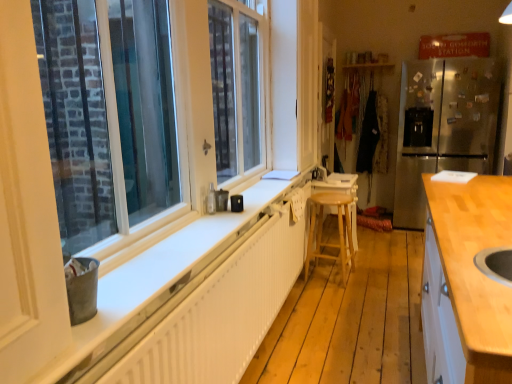
Locate an element on the screen. vacant area located to the right-hand side of light brown wooden stool at center is located at coordinates (369, 279).